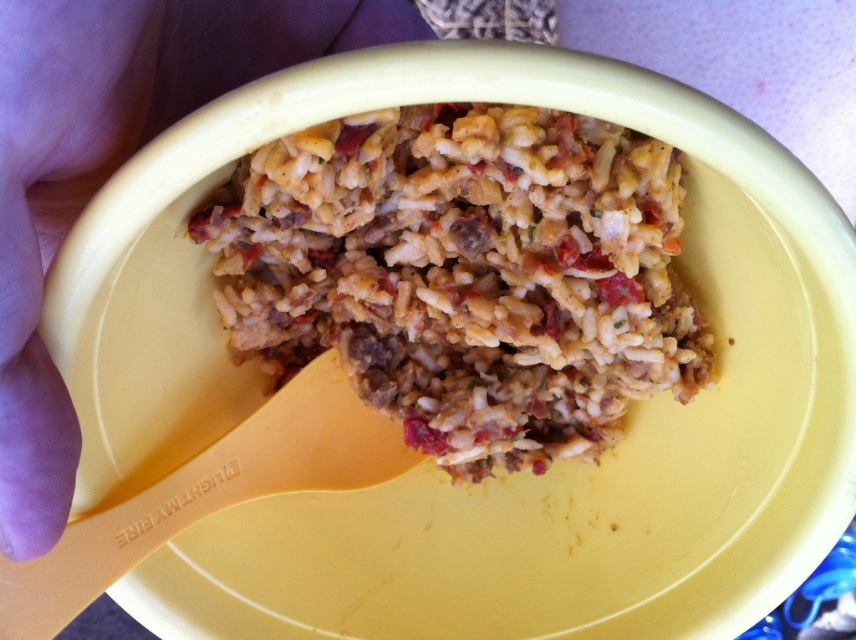
You are a chef preparing to serve this dish. You see the light skin at left and the yellow plastic spoon at lower left. Which object is closer to the left edge of the bowl?

The light skin at left is closer to the left edge of the bowl because it is positioned to the left of the yellow plastic spoon at lower left.

You are a food critic observing the image of a yellow bowl with a rice dish. You notice the brown matte rice at center and light skin at left. Which object is positioned lower in the bowl?

The brown matte rice at center is positioned lower than the light skin at left because it is below the light skin at left.

You are looking at the yellow bowl with the rice dish. There are two points marked in the image. From your perspective, which point is closer to you, point (x=80, y=152) or point (x=24, y=628)?

Point (x=80, y=152) is in front of point (x=24, y=628), so it is closer to you.